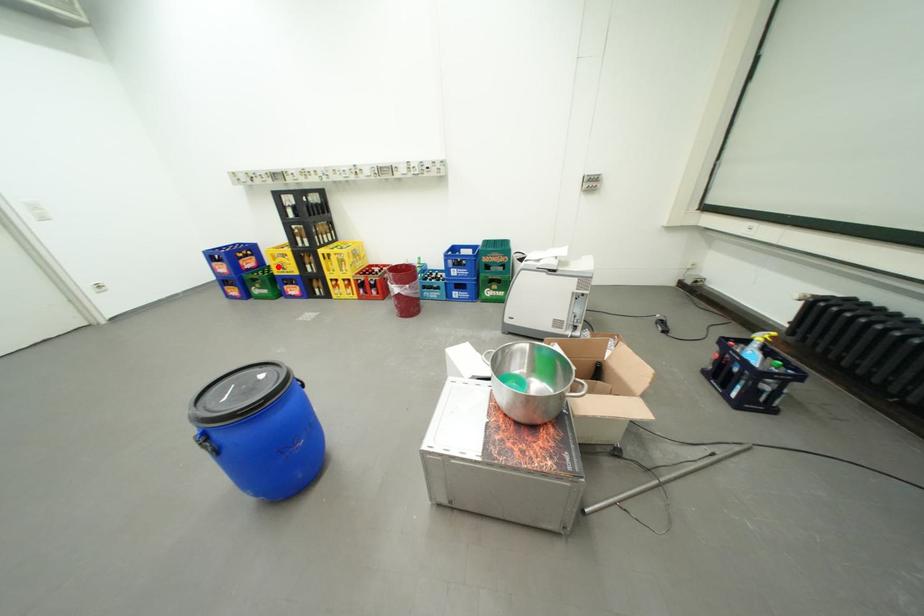
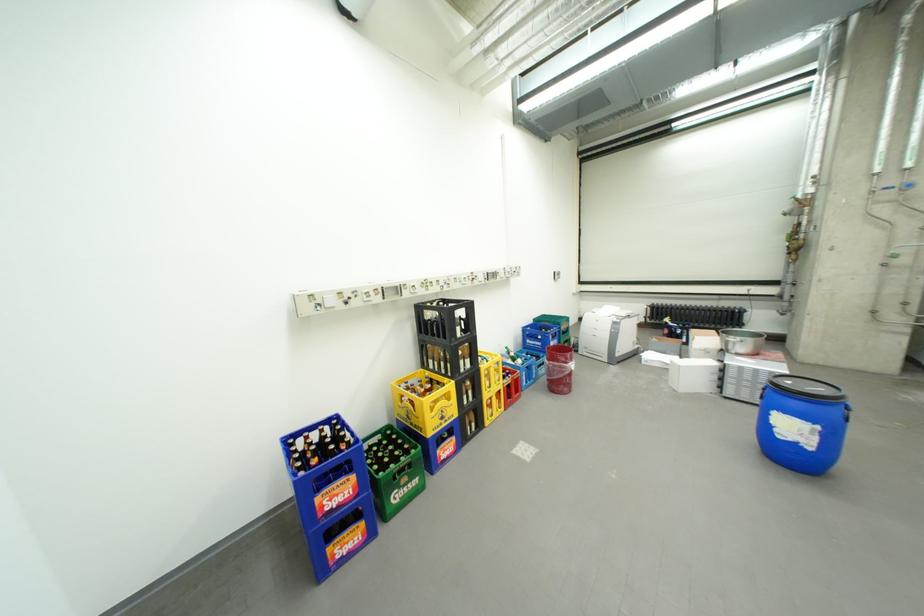
The point at the highlighted location is marked in the first image. Where is the corresponding point in the second image?

(387, 443)